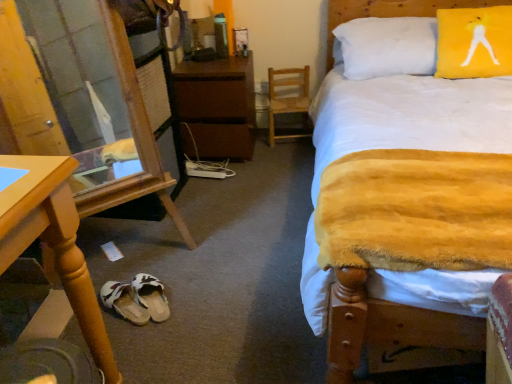
At what (x,y) coordinates should I click in order to perform the action: click on vacant space in front of white fabric sandals at lower center, placed as the second footwear when sorted from right to left. Please return your answer as a coordinate pair (x, y). Looking at the image, I should click on (132, 340).